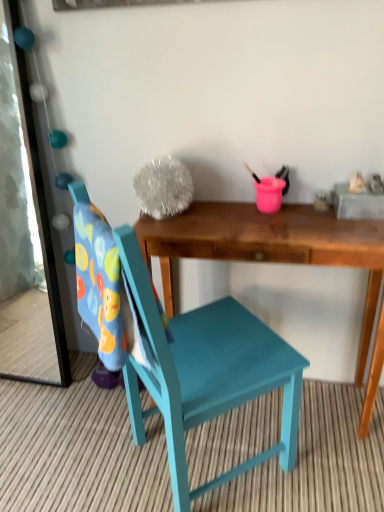
Where is `wooden desk at center`? This screenshot has height=512, width=384. wooden desk at center is located at coordinates (268, 246).

What do you see at coordinates (206, 372) in the screenshot? I see `teal painted wood chair at center` at bounding box center [206, 372].

Identify the location of metallic mirror at left. This screenshot has height=512, width=384. (25, 234).

Identify the location of wooden desk at center. (268, 246).

This screenshot has width=384, height=512. I want to click on mirror positioned vertically above the wooden desk at center (from a real-world perspective), so click(25, 234).

Is wooden desk at center located within metallic mirror at left?

That's incorrect, wooden desk at center is not inside metallic mirror at left.

Is metallic mirror at left closer to camera compared to wooden desk at center?

No, metallic mirror at left is behind wooden desk at center.

Visually, is metallic mirror at left positioned to the left or to the right of wooden desk at center?

From the image, it's evident that metallic mirror at left is to the left of wooden desk at center.

Considering the relative positions of wooden desk at center and metallic mirror at left in the image provided, is wooden desk at center to the left of metallic mirror at left from the viewer's perspective?

In fact, wooden desk at center is to the right of metallic mirror at left.

Identify the location of mirror located above the wooden desk at center (from a real-world perspective). This screenshot has width=384, height=512. (25, 234).

Is metallic mirror at left at the back of wooden desk at center?

No, wooden desk at center is not facing the opposite direction of metallic mirror at left.

Between wooden desk at center and metallic mirror at left, which one has smaller size?

metallic mirror at left.

Could you tell me if teal painted wood chair at center is facing metallic mirror at left?

No, teal painted wood chair at center is not facing towards metallic mirror at left.

From a real-world perspective, does teal painted wood chair at center stand above metallic mirror at left?

Actually, teal painted wood chair at center is physically below metallic mirror at left in the real world.

Which object is thinner, teal painted wood chair at center or metallic mirror at left?

Thinner between the two is metallic mirror at left.

Considering the relative sizes of teal painted wood chair at center and metallic mirror at left in the image provided, is teal painted wood chair at center taller than metallic mirror at left?

Yes.

Which of these two, teal painted wood chair at center or wooden desk at center, stands taller?

teal painted wood chair at center.

From a real-world perspective, is teal painted wood chair at center physically below wooden desk at center?

No.

Is teal painted wood chair at center oriented towards wooden desk at center?

Yes, teal painted wood chair at center is oriented towards wooden desk at center.

Is metallic mirror at left outside of teal painted wood chair at center?

Yes, metallic mirror at left is not within teal painted wood chair at center.

Is metallic mirror at left next to teal painted wood chair at center?

No, metallic mirror at left is not touching teal painted wood chair at center.

From the image's perspective, would you say metallic mirror at left is shown under teal painted wood chair at center?

No.

From a real-world perspective, is metallic mirror at left on top of teal painted wood chair at center?

Yes.

The width and height of the screenshot is (384, 512). Identify the location of chair above the wooden desk at center (from a real-world perspective). (206, 372).

Does wooden desk at center appear on the left side of teal painted wood chair at center?

No, wooden desk at center is not to the left of teal painted wood chair at center.

From the image's perspective, who appears lower, wooden desk at center or teal painted wood chair at center?

From the image's view, teal painted wood chair at center is below.

Is wooden desk at center directly adjacent to teal painted wood chair at center?

There is a gap between wooden desk at center and teal painted wood chair at center.

What are the coordinates of `desk that is on the right side of metallic mirror at left` in the screenshot? It's located at (268, 246).

Find the location of `mirror behind the wooden desk at center`. mirror behind the wooden desk at center is located at coordinates (25, 234).

Based on their spatial positions, is teal painted wood chair at center or wooden desk at center closer to metallic mirror at left?

teal painted wood chair at center lies closer to metallic mirror at left than the other object.

Looking at this image, which object lies nearer to the anchor point wooden desk at center, teal painted wood chair at center or metallic mirror at left?

teal painted wood chair at center.

Which object lies further to the anchor point wooden desk at center, metallic mirror at left or teal painted wood chair at center?

metallic mirror at left is further to wooden desk at center.

Looking at the image, which one is located further to teal painted wood chair at center, wooden desk at center or metallic mirror at left?

metallic mirror at left is positioned further to the anchor teal painted wood chair at center.

Based on their spatial positions, is wooden desk at center or teal painted wood chair at center further from metallic mirror at left?

wooden desk at center lies further to metallic mirror at left than the other object.

Based on their spatial positions, is metallic mirror at left or wooden desk at center further from teal painted wood chair at center?

metallic mirror at left.

Where is `chair between metallic mirror at left and wooden desk at center in the horizontal direction`? This screenshot has width=384, height=512. chair between metallic mirror at left and wooden desk at center in the horizontal direction is located at coordinates (206, 372).